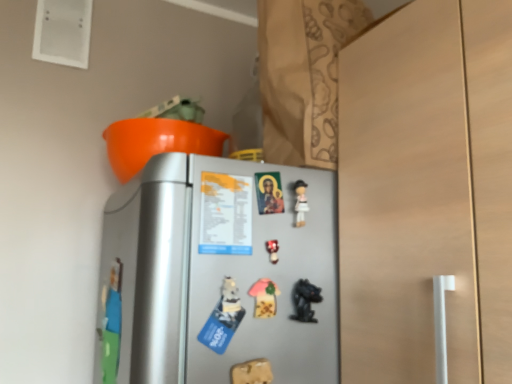
Question: Can you confirm if matte plastic toy at center, which is the first toy in top-to-bottom order, is shorter than pink fabric mushroom at center, the 2th toy in the top-to-bottom sequence?

Choices:
 (A) no
 (B) yes

Answer: (B)

Question: Does matte plastic toy at center, which is the first toy in top-to-bottom order, have a smaller size compared to pink fabric mushroom at center, acting as the 3th toy starting from the bottom?

Choices:
 (A) no
 (B) yes

Answer: (B)

Question: Can you confirm if matte plastic toy at center, which is the fourth toy from bottom to top, is thinner than pink fabric mushroom at center, the 2th toy in the top-to-bottom sequence?

Choices:
 (A) no
 (B) yes

Answer: (B)

Question: Is matte plastic toy at center, which is the first toy in top-to-bottom order, in contact with pink fabric mushroom at center, acting as the 3th toy starting from the bottom?

Choices:
 (A) no
 (B) yes

Answer: (B)

Question: Would you consider matte plastic toy at center, which is the first toy in top-to-bottom order, to be distant from pink fabric mushroom at center, the 2th toy in the top-to-bottom sequence?

Choices:
 (A) yes
 (B) no

Answer: (B)

Question: In terms of height, does matte plastic toy at center, which is the first toy in top-to-bottom order, look taller or shorter compared to black glossy figurine at lower center, positioned as the second toy in bottom-to-top order?

Choices:
 (A) short
 (B) tall

Answer: (A)

Question: From a real-world perspective, is matte plastic toy at center, which is the first toy in top-to-bottom order, positioned above or below black glossy figurine at lower center, the 3th toy when ordered from top to bottom?

Choices:
 (A) below
 (B) above

Answer: (B)

Question: Considering the positions of point (269, 240) and point (298, 294), is point (269, 240) closer or farther from the camera than point (298, 294)?

Choices:
 (A) farther
 (B) closer

Answer: (B)

Question: Looking at their shapes, would you say matte plastic toy at center, which is the first toy in top-to-bottom order, is wider or thinner than black glossy figurine at lower center, positioned as the second toy in bottom-to-top order?

Choices:
 (A) thin
 (B) wide

Answer: (A)

Question: Would you say pink fabric mushroom at center, acting as the 3th toy starting from the bottom, is to the left or to the right of wooden toy at lower center, which is the 1th toy in bottom-to-top order, in the picture?

Choices:
 (A) right
 (B) left

Answer: (A)

Question: Is pink fabric mushroom at center, the 2th toy in the top-to-bottom sequence, taller or shorter than wooden toy at lower center, which is the 4th toy from top to bottom?

Choices:
 (A) tall
 (B) short

Answer: (A)

Question: Considering the positions of pink fabric mushroom at center, acting as the 3th toy starting from the bottom, and wooden toy at lower center, which is the 4th toy from top to bottom, in the image, is pink fabric mushroom at center, acting as the 3th toy starting from the bottom, wider or thinner than wooden toy at lower center, which is the 4th toy from top to bottom,?

Choices:
 (A) thin
 (B) wide

Answer: (B)

Question: Does point (x=268, y=279) appear closer or farther from the camera than point (x=243, y=380)?

Choices:
 (A) closer
 (B) farther

Answer: (B)

Question: From the image's perspective, is wooden toy at lower center, which is the 1th toy in bottom-to-top order, positioned above or below silver metallic refrigerator at center?

Choices:
 (A) above
 (B) below

Answer: (B)

Question: From a real-world perspective, is wooden toy at lower center, which is the 1th toy in bottom-to-top order, positioned above or below silver metallic refrigerator at center?

Choices:
 (A) below
 (B) above

Answer: (A)